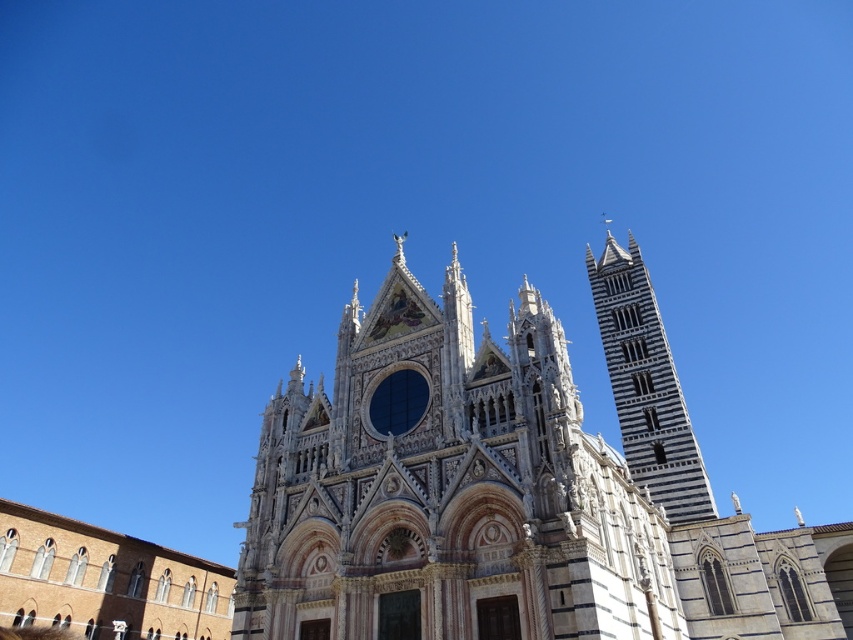
Is white stone church at center bigger than white marble tower at right?

Yes, white stone church at center is bigger than white marble tower at right.

Does white stone church at center have a smaller size compared to white marble tower at right?

No.

Between point (425, 387) and point (659, 460), which one is positioned in front?

Point (425, 387) is in front.

This screenshot has height=640, width=853. Find the location of `white stone church at center`. white stone church at center is located at coordinates (509, 488).